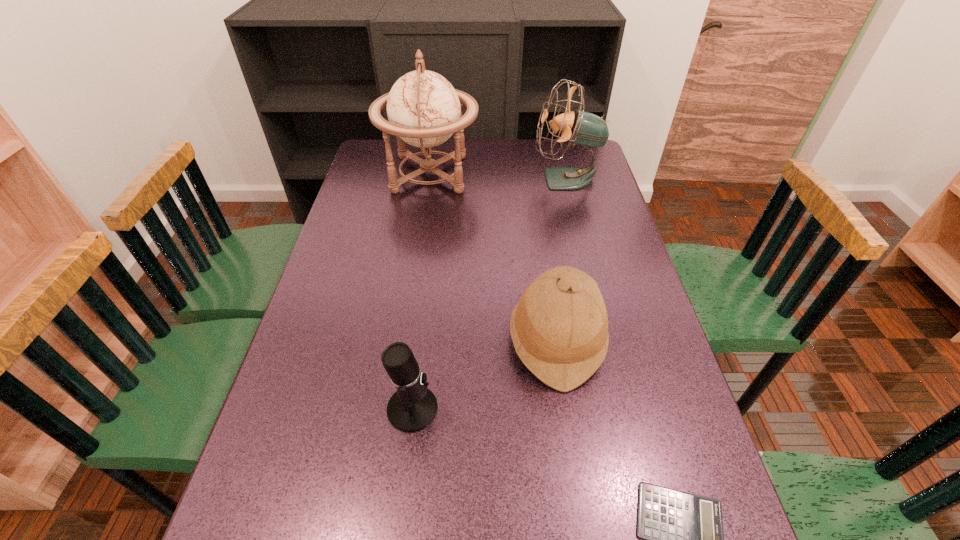
Identify the location of free space in the image that satisfies the following two spatial constraints: 1. on the front-facing side of the fan for air flow; 2. on the front side of the second shortest object. This screenshot has width=960, height=540. click(623, 409).

Identify the location of free spot that satisfies the following two spatial constraints: 1. on the front-facing side of the hat; 2. on the front side of the microphone. Image resolution: width=960 pixels, height=540 pixels. (566, 409).